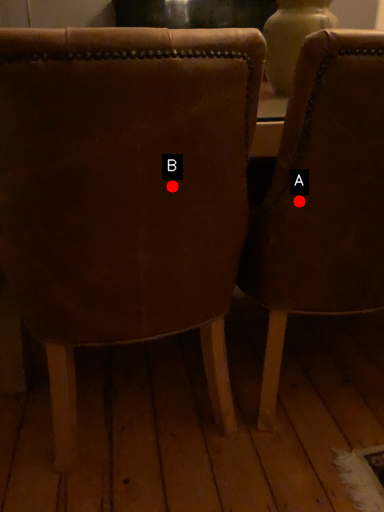
Question: Two points are circled on the image, labeled by A and B beside each circle. Which point is closer to the camera?

Choices:
 (A) A is closer
 (B) B is closer

Answer: (B)